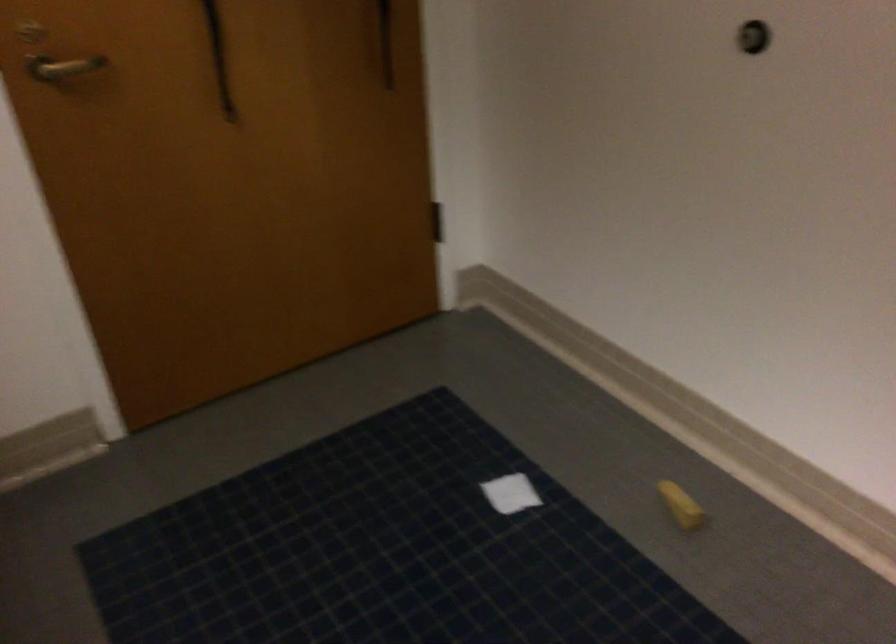
This screenshot has height=644, width=896. Find the location of `door handle`. door handle is located at coordinates (62, 67).